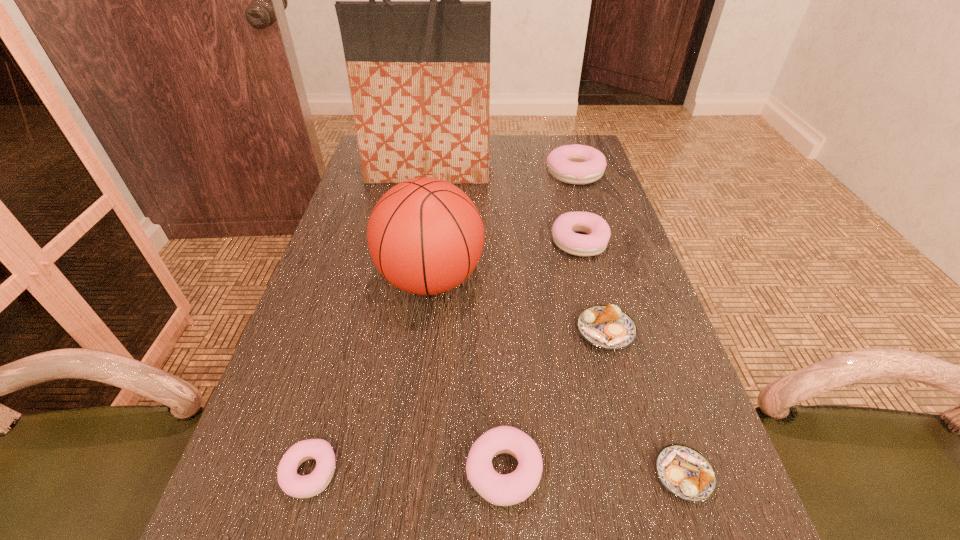
Where is `free space that satisfies the following two spatial constraints: 1. on the front-facing side of the tallest object; 2. on the right side of the fifth nearest pastry`? Image resolution: width=960 pixels, height=540 pixels. free space that satisfies the following two spatial constraints: 1. on the front-facing side of the tallest object; 2. on the right side of the fifth nearest pastry is located at coordinates (417, 241).

Where is `free spot that satisfies the following two spatial constraints: 1. on the front-facing side of the second smallest pink pastry; 2. on the left side of the tallest object`? This screenshot has height=540, width=960. free spot that satisfies the following two spatial constraints: 1. on the front-facing side of the second smallest pink pastry; 2. on the left side of the tallest object is located at coordinates (378, 471).

This screenshot has height=540, width=960. I want to click on free space that satisfies the following two spatial constraints: 1. on the back side of the sixth shortest object; 2. on the left side of the basketball, so click(x=444, y=174).

This screenshot has width=960, height=540. Identify the location of free space in the image that satisfies the following two spatial constraints: 1. on the front side of the second biggest pink pastry; 2. on the right side of the nearer brown pastry. (641, 475).